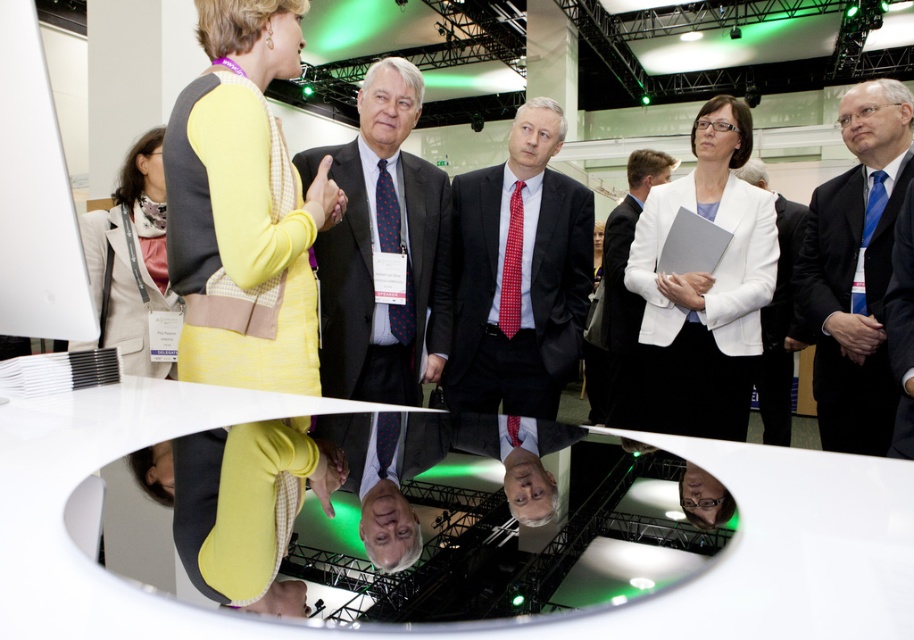
Question: Can you confirm if dark suit at center is thinner than white matte business suit at center?

Choices:
 (A) yes
 (B) no

Answer: (B)

Question: Which object is positioned farthest from the red dotted tie at center?

Choices:
 (A) blue silk tie at upper right
 (B) yellow fabric dress at center
 (C) matte yellow dress at center
 (D) white fabric suit at center

Answer: (C)

Question: Is yellow fabric dress at center in front of white suit at center?

Choices:
 (A) no
 (B) yes

Answer: (B)

Question: Which point is closer to the camera?

Choices:
 (A) dark suit at center
 (B) white fabric suit at center
 (C) yellow fabric dress at center

Answer: (C)

Question: Which point is closer to the camera taking this photo?

Choices:
 (A) pos(870,218)
 (B) pos(610,365)
 (C) pos(615,328)

Answer: (A)

Question: Observing the image, what is the correct spatial positioning of matte yellow dress at center in reference to white matte business suit at center?

Choices:
 (A) right
 (B) left

Answer: (B)